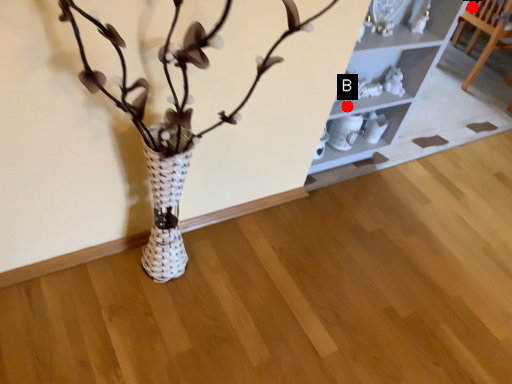
Question: Two points are circled on the image, labeled by A and B beside each circle. Which point appears closest to the camera in this image?

Choices:
 (A) A is closer
 (B) B is closer

Answer: (B)